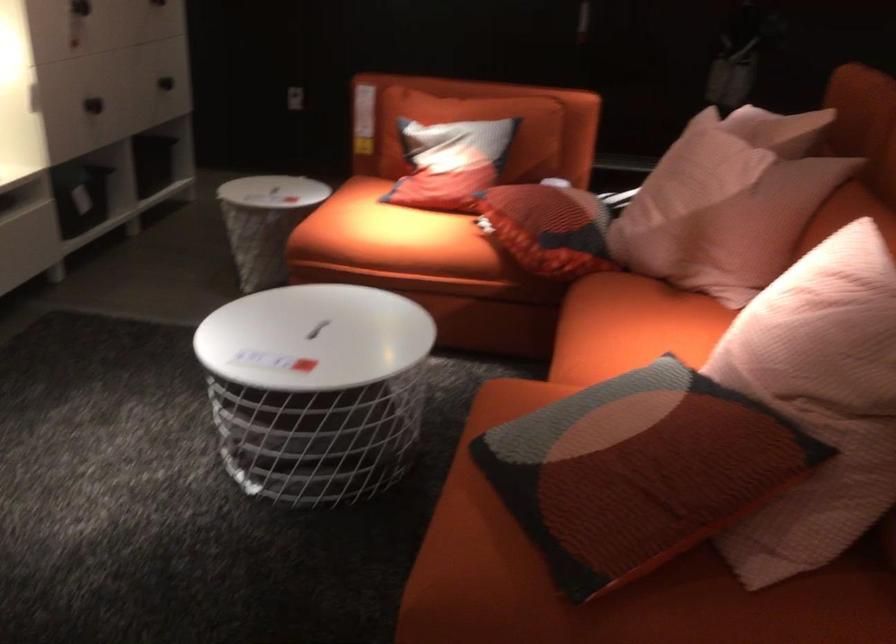
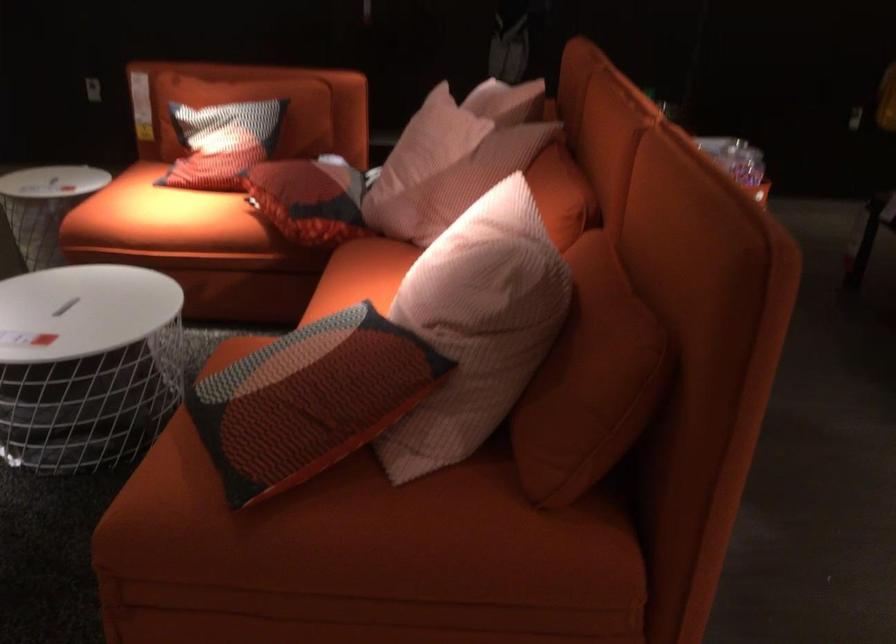
Question: The images are taken continuously from a first-person perspective. In which direction is your viewpoint rotating?

Choices:
 (A) Left
 (B) Right
 (C) Up
 (D) Down

Answer: (B)